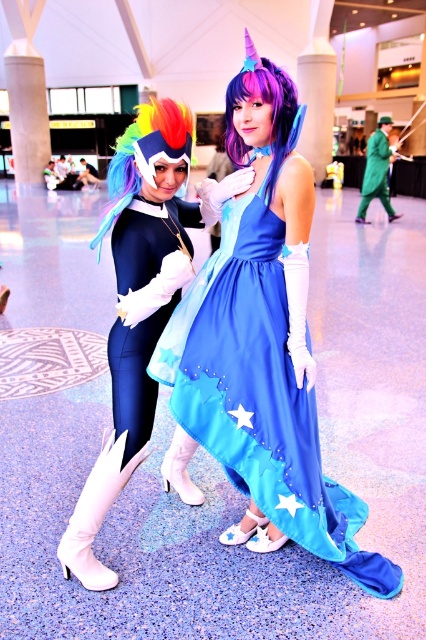
You are a photographer setting up for a group photo in the convention hall. You need to position the blue satin dress at center and the matte black bodysuit at center side by side. Given their sizes, which costume should be placed closer to the edges to avoid overcrowding the frame?

The blue satin dress at center is wider than the matte black bodysuit at center, so placing the wider blue satin dress at center closer to the edges will help prevent overcrowding the frame.

You are a photographer at the convention and want to capture a photo where both the blue satin dress at center and the rainbow hair at left are visible. Considering their heights, which object should be positioned closer to the camera to ensure both are fully visible in the frame?

The blue satin dress at center is much taller than the rainbow hair at left, so positioning the rainbow hair at left closer to the camera will help ensure both are fully visible in the frame.